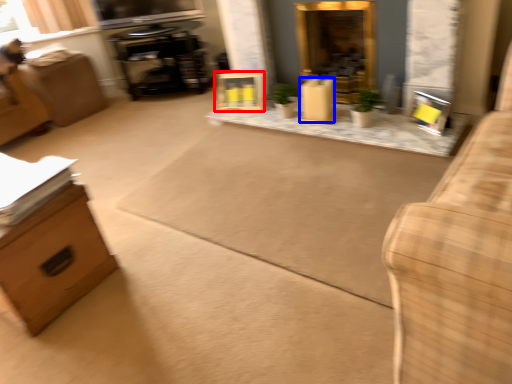
Question: Which object appears closest to the camera in this image, picture frame (highlighted by a red box) or box (highlighted by a blue box)?

Choices:
 (A) picture frame
 (B) box

Answer: (B)